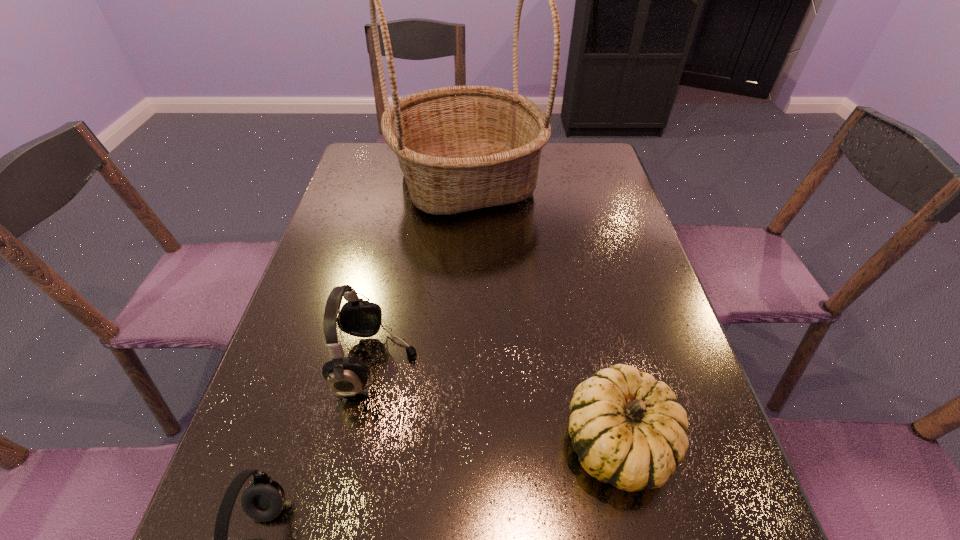
At what (x,y) coordinates should I click in order to perform the action: click on the farthest object. Please return your answer as a coordinate pair (x, y). This screenshot has height=540, width=960. Looking at the image, I should click on (460, 148).

The image size is (960, 540). I want to click on the tallest object, so click(460, 148).

Image resolution: width=960 pixels, height=540 pixels. What are the coordinates of `the second tallest object` in the screenshot? It's located at (346, 376).

I want to click on the taller headset, so click(346, 376).

At what (x,y) coordinates should I click in order to perform the action: click on gourd. Please return your answer as a coordinate pair (x, y). The width and height of the screenshot is (960, 540). Looking at the image, I should click on (628, 430).

I want to click on vacant space located 0.080m on the front of the basket, so click(x=464, y=248).

This screenshot has height=540, width=960. I want to click on vacant space located with the microphone on the side of the taller headset, so click(532, 363).

This screenshot has height=540, width=960. What are the coordinates of `vacant region located on the back of the gourd` in the screenshot? It's located at (600, 362).

At what (x,y) coordinates should I click in order to perform the action: click on object at the far edge. Please return your answer as a coordinate pair (x, y). This screenshot has height=540, width=960. Looking at the image, I should click on (460, 148).

Where is `basket situated at the left edge`? basket situated at the left edge is located at coordinates (460, 148).